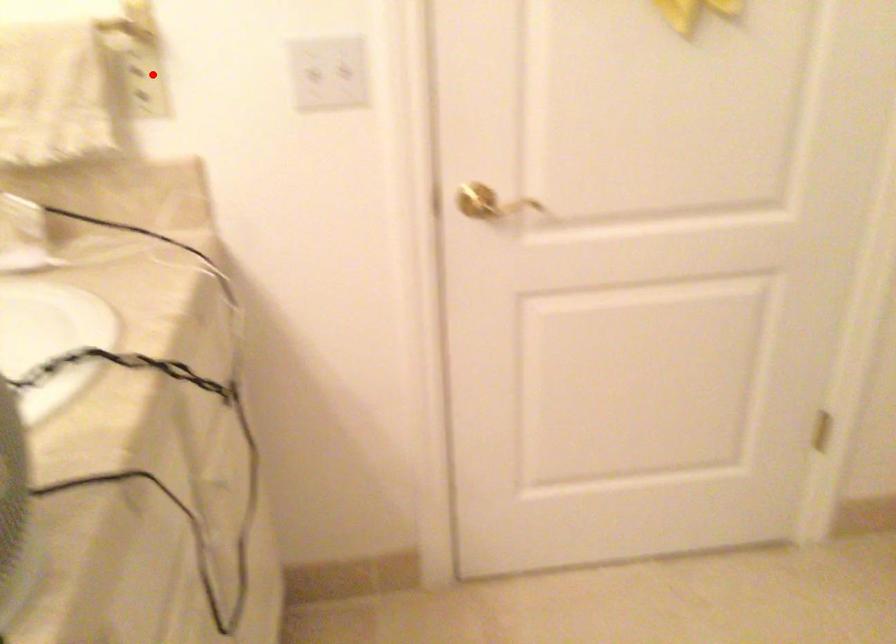
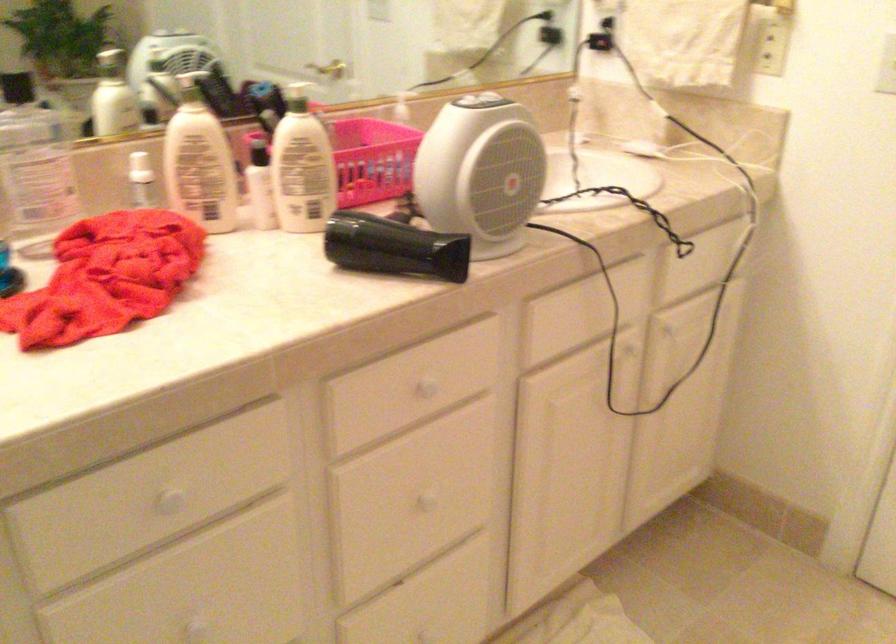
Where in the second image is the point corresponding to the highlighted location from the first image?

(771, 46)